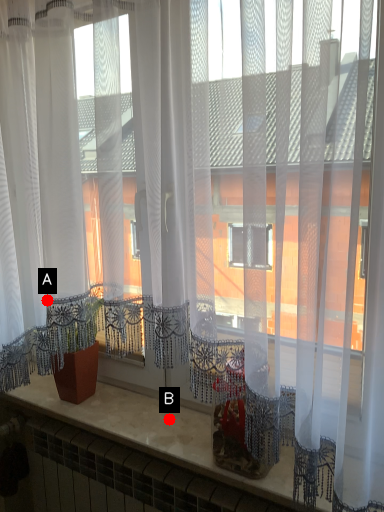
Question: Two points are circled on the image, labeled by A and B beside each circle. Which point appears closest to the camera in this image?

Choices:
 (A) A is closer
 (B) B is closer

Answer: (A)